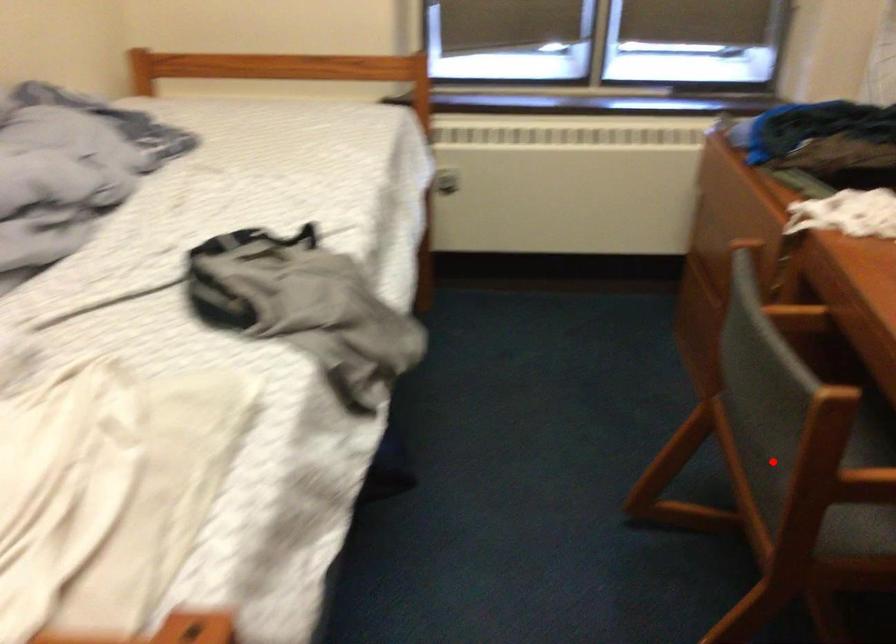
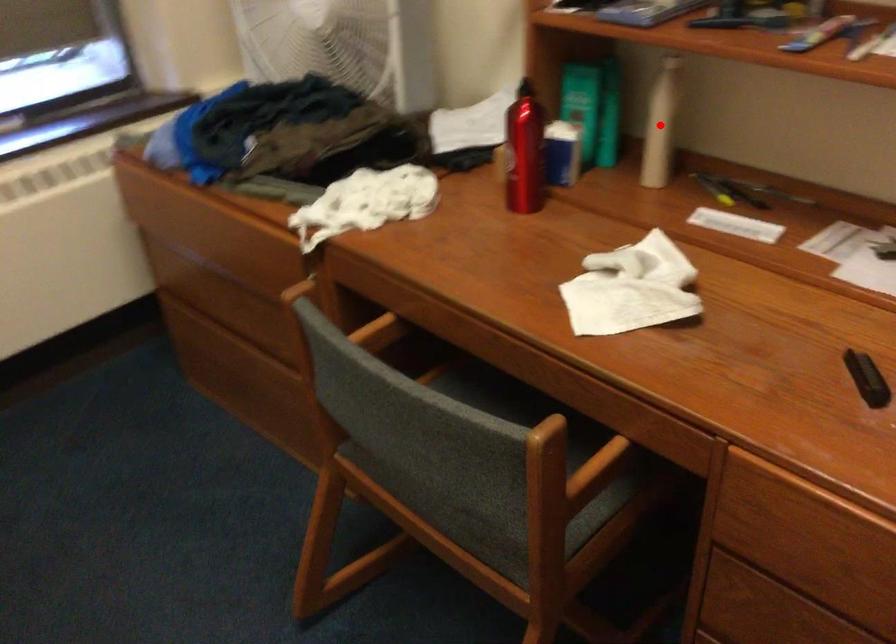
I am providing you with two images of the same scene from different viewpoints. A red point is marked on the first image and another point is marked on the second image. Do the highlighted points in image1 and image2 indicate the same real-world spot?

No